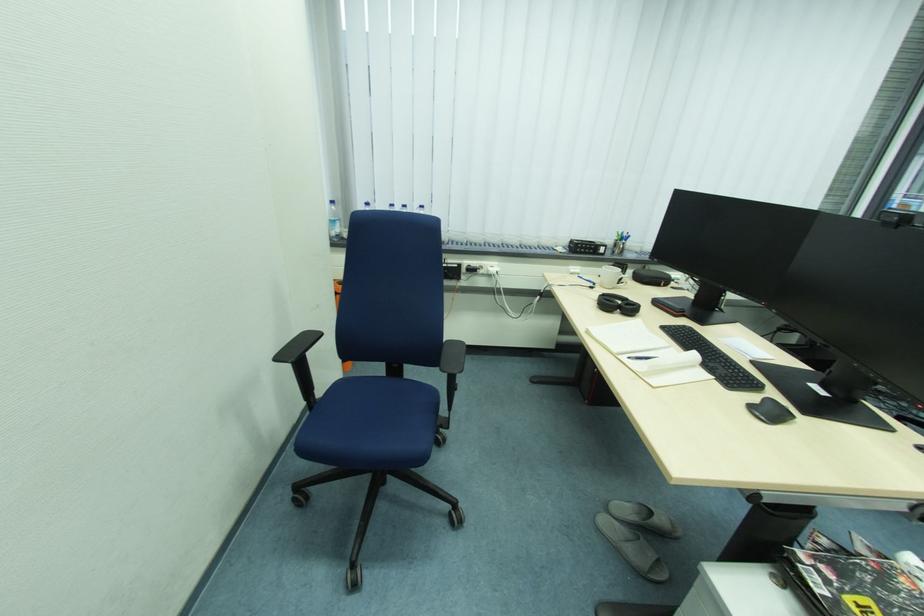
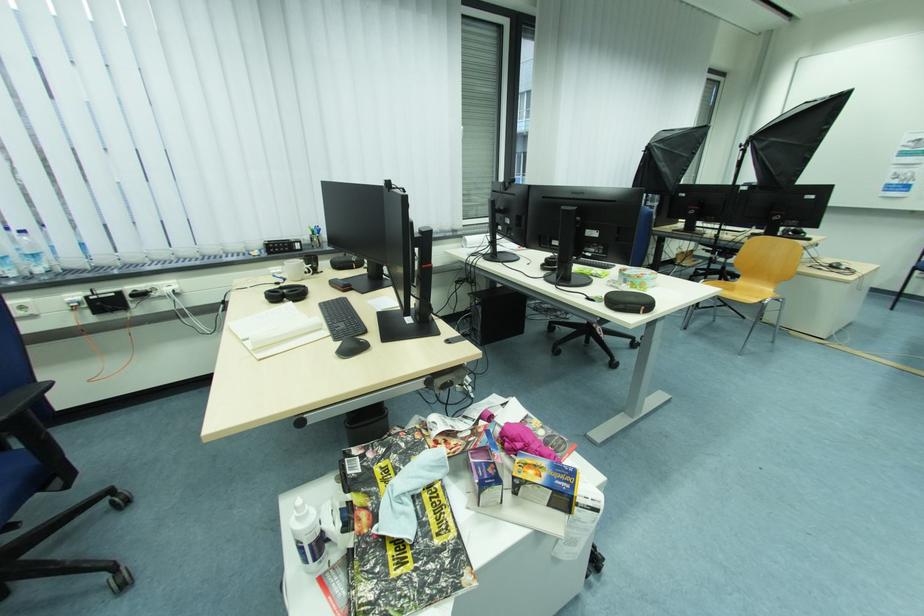
Question: The camera is either moving clockwise (left) or counter-clockwise (right) around the object. The first image is from the beginning of the video and the second image is from the end. Is the camera moving left or right when shooting the video?

Choices:
 (A) Left
 (B) Right

Answer: (A)